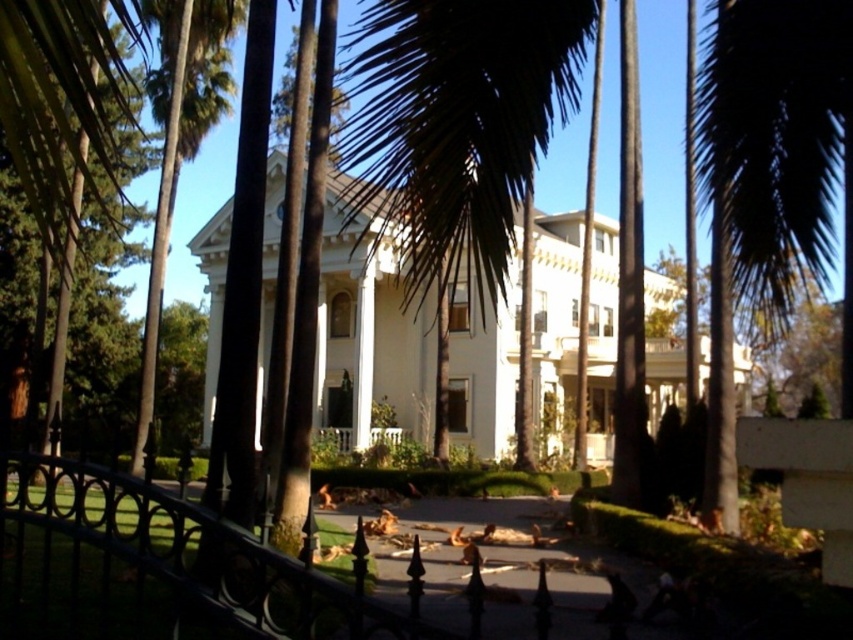
Question: Which is farther from the dark green leafy palm tree at center?

Choices:
 (A) green leafy palm tree at left
 (B) white glossy mansion at center
 (C) green leafy palm tree at center

Answer: (C)

Question: Can you confirm if green leafy palm tree at center is positioned above green leafy palm tree at left?

Choices:
 (A) yes
 (B) no

Answer: (B)

Question: Which of the following is the closest to the observer?

Choices:
 (A) white glossy mansion at center
 (B) green leafy palm tree at left
 (C) dark green leafy palm tree at center

Answer: (C)

Question: Among these objects, which one is farthest from the camera?

Choices:
 (A) green leafy palm tree at center
 (B) white glossy mansion at center

Answer: (B)

Question: Is white glossy mansion at center smaller than dark green leafy palm tree at center?

Choices:
 (A) no
 (B) yes

Answer: (A)

Question: Is green leafy palm tree at center above green leafy palm tree at left?

Choices:
 (A) yes
 (B) no

Answer: (B)